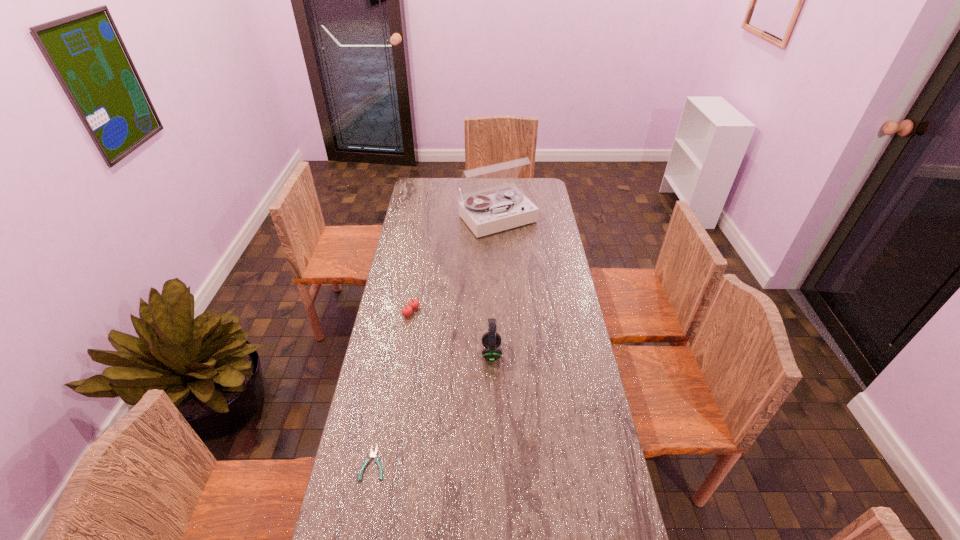
Identify the location of empty space between the second farthest object and the second tallest object. Image resolution: width=960 pixels, height=540 pixels. (451, 332).

Find the location of a particular element. The width and height of the screenshot is (960, 540). empty space that is in between the headset and the third tallest object is located at coordinates (451, 332).

Identify the location of unoccupied position between the record player and the third shortest object. (493, 285).

Find the location of a particular element. Image resolution: width=960 pixels, height=540 pixels. the second closest object to the cherry is located at coordinates (484, 214).

Identify which object is the second nearest to the shortest object. Please provide its 2D coordinates. Your answer should be formatted as a tuple, i.e. [(x, y)], where the tuple contains the x and y coordinates of a point satisfying the conditions above.

[(414, 303)]

Where is `vacant region that satisfies the following two spatial constraints: 1. on the back side of the third tallest object; 2. on the right side of the nearest object`? vacant region that satisfies the following two spatial constraints: 1. on the back side of the third tallest object; 2. on the right side of the nearest object is located at coordinates coord(401,312).

In order to click on free region that satisfies the following two spatial constraints: 1. on the back side of the record player; 2. on the left side of the cherry in this screenshot , I will do `click(426, 218)`.